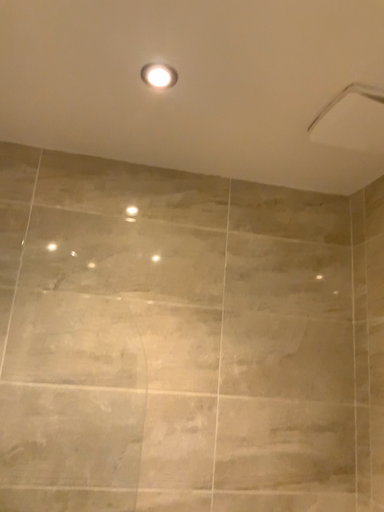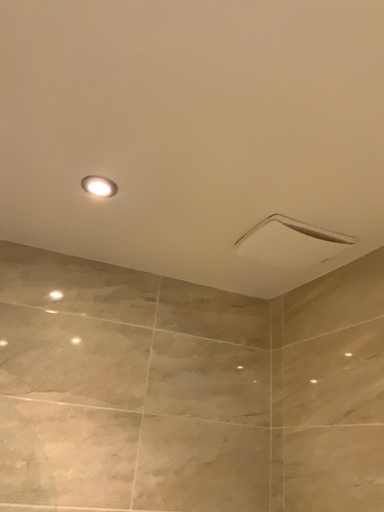
Question: How did the camera likely rotate when shooting the video?

Choices:
 (A) rotated downward
 (B) rotated upward

Answer: (B)